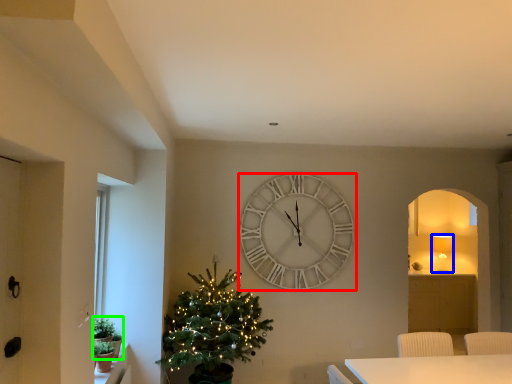
Question: Considering the real-world distances, which object is closest to wall clock (highlighted by a red box)? lamp (highlighted by a blue box) or plant (highlighted by a green box).

Choices:
 (A) lamp
 (B) plant

Answer: (B)